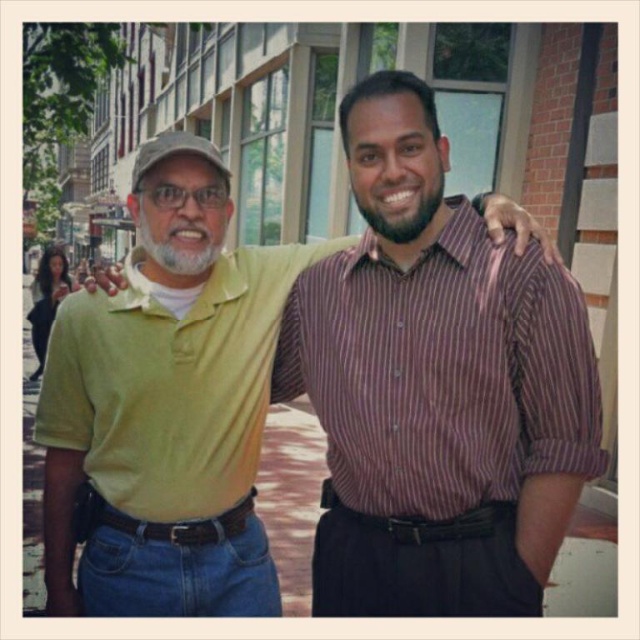
You are a photographer trying to capture a closeup of the green cotton polo shirt at center. Based on its position coordinates, can you estimate whether it would be in the left or right half of the image?

The green cotton polo shirt at center is located at point coordinates where the x value is 0.637, which is greater than 0.5, so it is in the right half of the image.